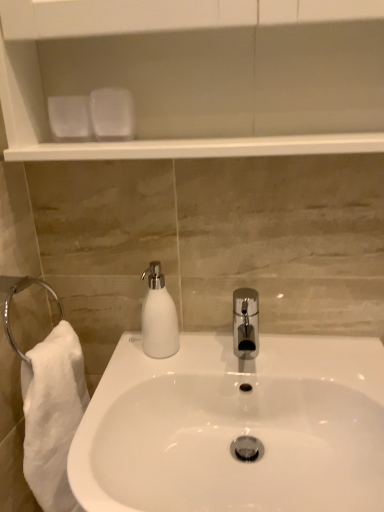
Find the location of a particular element. The height and width of the screenshot is (512, 384). free point in front of white matte soap dispenser at center is located at coordinates (139, 384).